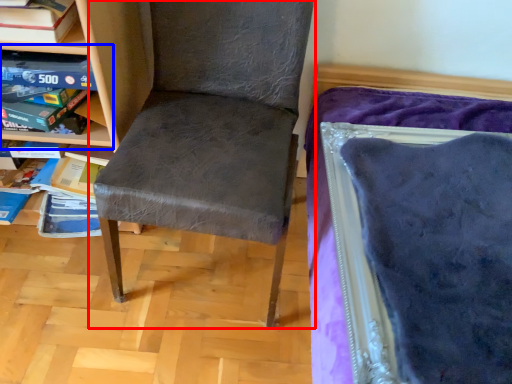
Question: Among these objects, which one is farthest to the camera, chair (highlighted by a red box) or shelf (highlighted by a blue box)?

Choices:
 (A) chair
 (B) shelf

Answer: (B)